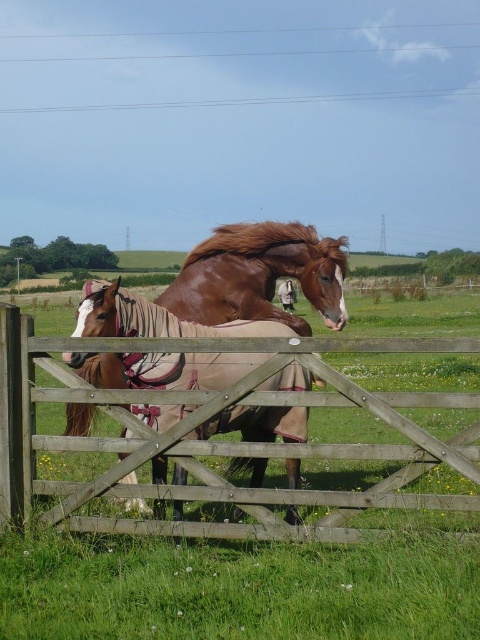
You are standing in front of the wooden gate and want to take a photo of both horses. Which point should you focus on first to ensure both are in focus? The options are point A at coordinates point(29,387) and point B at coordinates point(298,323).

Point A at coordinates point(29,387) is closer to the camera than point B at coordinates point(298,323). To ensure both are in focus, you should focus on the closer point first, which is point A.

You are a farmer who needs to lead the brown glossy horse at center through the wooden gate at center. Based on the scene, will the horse be able to pass through the gate without bending its head?

The wooden gate at center has a lesser height compared to brown glossy horse at center, which means the gate is shorter than the horse. Therefore, the horse would need to bend its head to pass through the wooden gate at center to avoid hitting its head.